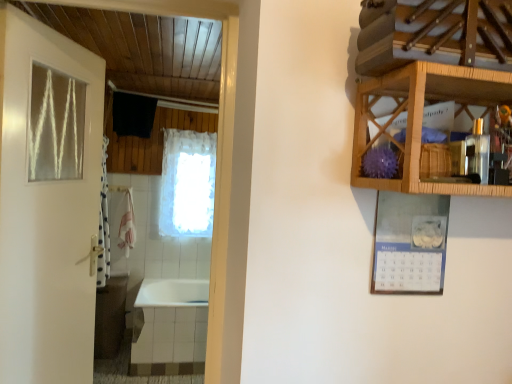
Question: Considering the relative sizes of wooden cabinet at upper right and pink fabric towel at left in the image provided, is wooden cabinet at upper right bigger than pink fabric towel at left?

Choices:
 (A) yes
 (B) no

Answer: (A)

Question: From a real-world perspective, does wooden cabinet at upper right stand above pink fabric towel at left?

Choices:
 (A) no
 (B) yes

Answer: (B)

Question: Is wooden cabinet at upper right not near pink fabric towel at left?

Choices:
 (A) yes
 (B) no

Answer: (A)

Question: Considering the relative sizes of wooden cabinet at upper right and pink fabric towel at left in the image provided, is wooden cabinet at upper right shorter than pink fabric towel at left?

Choices:
 (A) no
 (B) yes

Answer: (B)

Question: Is wooden cabinet at upper right thinner than pink fabric towel at left?

Choices:
 (A) yes
 (B) no

Answer: (B)

Question: Can we say wooden cabinet at upper right lies outside pink fabric towel at left?

Choices:
 (A) no
 (B) yes

Answer: (B)

Question: Would you say clear glass window at upper left contains wooden shelf at upper right?

Choices:
 (A) yes
 (B) no

Answer: (B)

Question: Are clear glass window at upper left and wooden shelf at upper right far apart?

Choices:
 (A) no
 (B) yes

Answer: (B)

Question: Is clear glass window at upper left shorter than wooden shelf at upper right?

Choices:
 (A) yes
 (B) no

Answer: (B)

Question: From a real-world perspective, is clear glass window at upper left physically below wooden shelf at upper right?

Choices:
 (A) yes
 (B) no

Answer: (A)

Question: From the image's perspective, is clear glass window at upper left on wooden shelf at upper right?

Choices:
 (A) yes
 (B) no

Answer: (B)

Question: Is clear glass window at upper left positioned before wooden shelf at upper right?

Choices:
 (A) yes
 (B) no

Answer: (B)

Question: From the image's perspective, is clear glass window at upper left above white lace curtain at center?

Choices:
 (A) no
 (B) yes

Answer: (B)